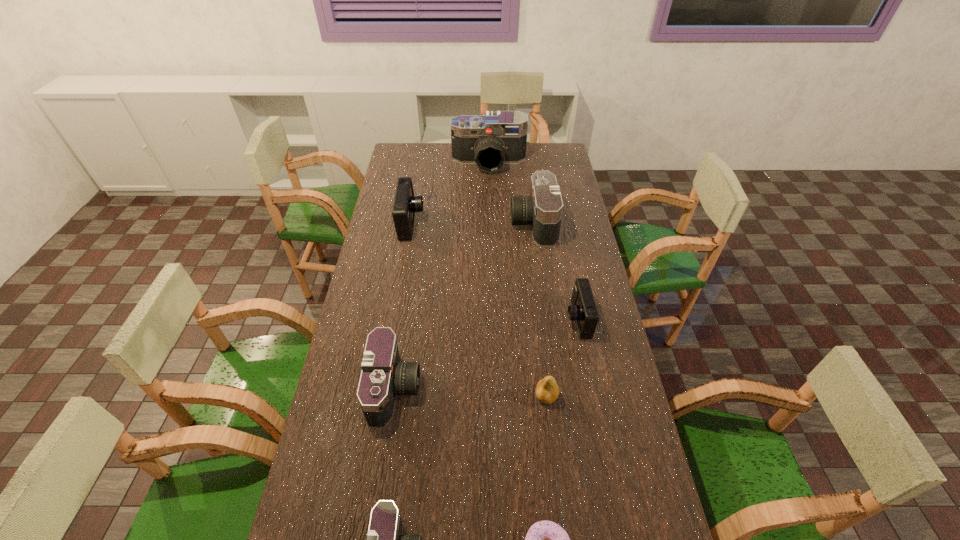
Where is `object positioned at the far edge`? The height and width of the screenshot is (540, 960). object positioned at the far edge is located at coordinates (498, 137).

This screenshot has width=960, height=540. Identify the location of vacant space at the far edge of the desktop. (444, 152).

Image resolution: width=960 pixels, height=540 pixels. Identify the location of vacant region at the left edge of the desktop. (370, 458).

This screenshot has height=540, width=960. In order to click on vacant space at the right edge of the desktop in this screenshot , I will do `click(569, 198)`.

You are a GUI agent. You are given a task and a screenshot of the screen. Output one action in this format:
    pyautogui.click(x=<x>, y=<y>)
    Task: Click on the vacant space at the far left corner of the desktop
    This screenshot has height=540, width=960.
    Given the screenshot: What is the action you would take?
    pyautogui.click(x=426, y=151)

Identify the location of free point between the left blue camera and the fifth nearest object. (494, 272).

Locate an element on the screen. The width and height of the screenshot is (960, 540). free spot between the pear and the third nearest camera is located at coordinates (562, 358).

Where is `free space between the bigger blue camera and the right blue camera`? This screenshot has width=960, height=540. free space between the bigger blue camera and the right blue camera is located at coordinates (494, 272).

I want to click on blank region between the third nearest black camera and the smaller blue camera, so click(x=555, y=272).

Locate an element on the screen. This screenshot has width=960, height=540. the fifth closest object to the nearest black camera is located at coordinates (405, 205).